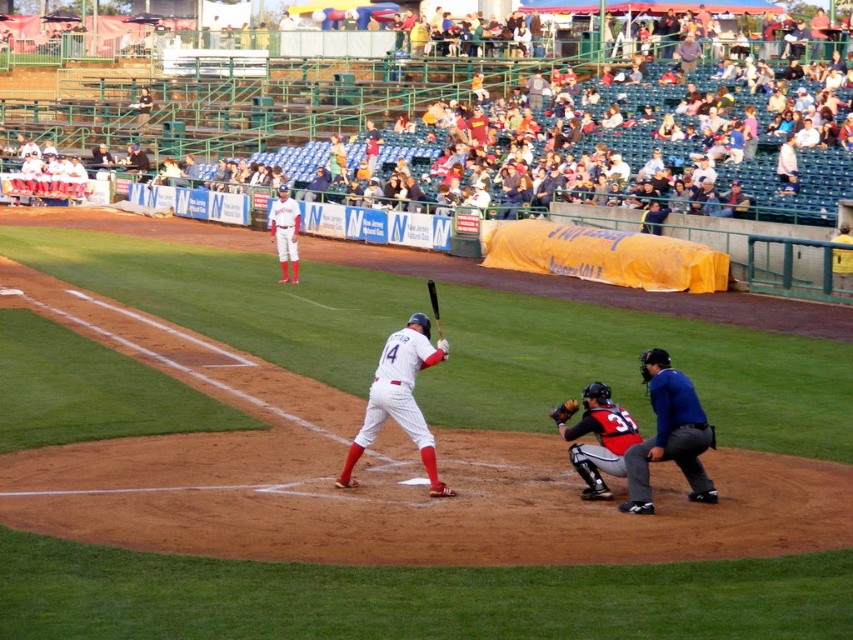
You are a spectator trying to watch the game from the white plastic seats at upper center. There is a blue fabric umpire at lower right standing between you and the batter. Will you be able to see the batter clearly?

The white plastic seats at upper center are much taller than the blue fabric umpire at lower right, so you will be able to see the batter clearly over the umpire.

You are a spectator sitting in the white plastic seats at upper center. You want to see the umpire, blue fabric umpire at lower right. Is the umpire visible to you from your current position?

The blue fabric umpire at lower right is behind the white plastic seats at upper center, so the umpire is not visible from your current position in the white plastic seats at upper center.

You are a spectator at the baseball game and want to sit down. You see the white plastic seats at upper center and the black matte bat at center. Which object is larger and can accommodate your sitting?

The white plastic seats at upper center is bigger than the black matte bat at center, so you can sit on the white plastic seats at upper center.